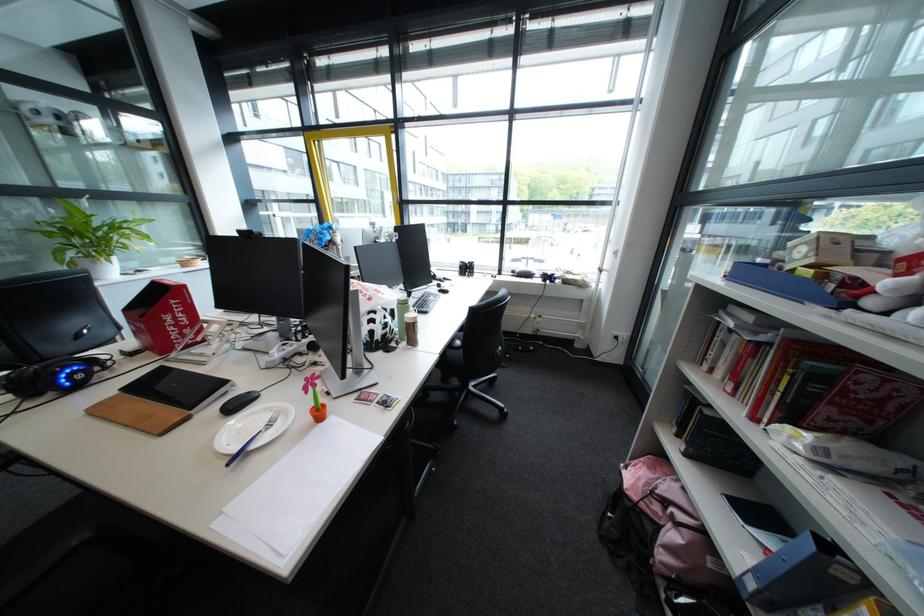
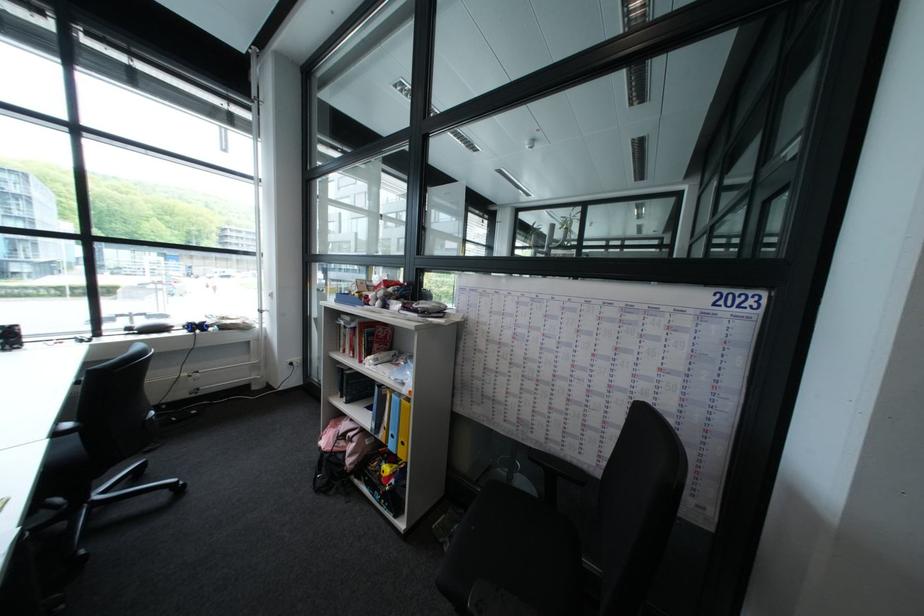
The point at (664, 468) is marked in the first image. Where is the corresponding point in the second image?

(348, 428)